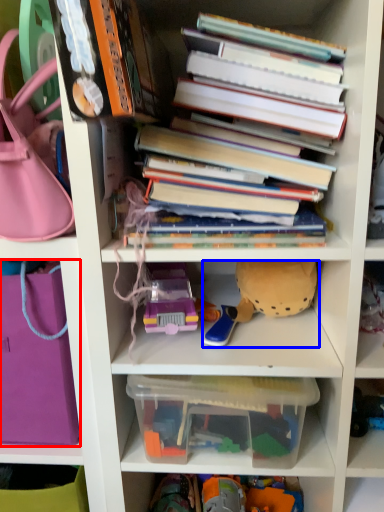
Question: Which of the following is the closest to the observer, handbag (highlighted by a red box) or toy (highlighted by a blue box)?

Choices:
 (A) handbag
 (B) toy

Answer: (A)